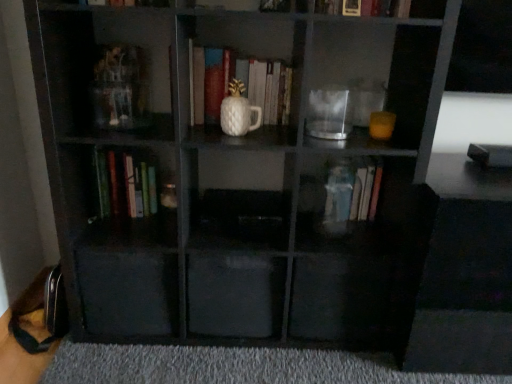
Question: From their relative heights in the image, would you say transparent glass jar at center is taller or shorter than transparent plastic drawer at lower left, which is the second drawer from right to left?

Choices:
 (A) short
 (B) tall

Answer: (A)

Question: From a real-world perspective, is transparent glass jar at center above or below transparent plastic drawer at lower left, the 1th drawer when ordered from left to right?

Choices:
 (A) below
 (B) above

Answer: (B)

Question: Which object is positioned closest to the hardcover book at upper center, positioned as the third book in left-to-right order?

Choices:
 (A) transparent glass jar at center
 (B) green matte book at lower left, the first book viewed from the left
 (C) white matte vase at center, which is the second book from left to right
 (D) transparent plastic drawer at lower left, the 1th drawer when ordered from left to right
 (E) transparent plastic drawer at center, arranged as the 1th drawer when viewed from the right

Answer: (A)

Question: Which of these objects is positioned farthest from the transparent plastic drawer at center, the second drawer positioned from the left?

Choices:
 (A) transparent glass jar at center
 (B) white matte vase at center, acting as the third book starting from the right
 (C) hardcover book at upper center, positioned as the third book in left-to-right order
 (D) transparent plastic drawer at lower left, which is the second drawer from right to left
 (E) gray carpet at lower center

Answer: (C)